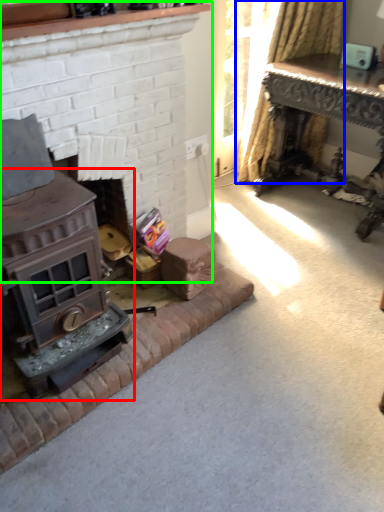
Question: Which object is positioned farthest from wood burning stove (highlighted by a red box)? Select from curtain (highlighted by a blue box) and fireplace (highlighted by a green box).

Choices:
 (A) curtain
 (B) fireplace

Answer: (A)